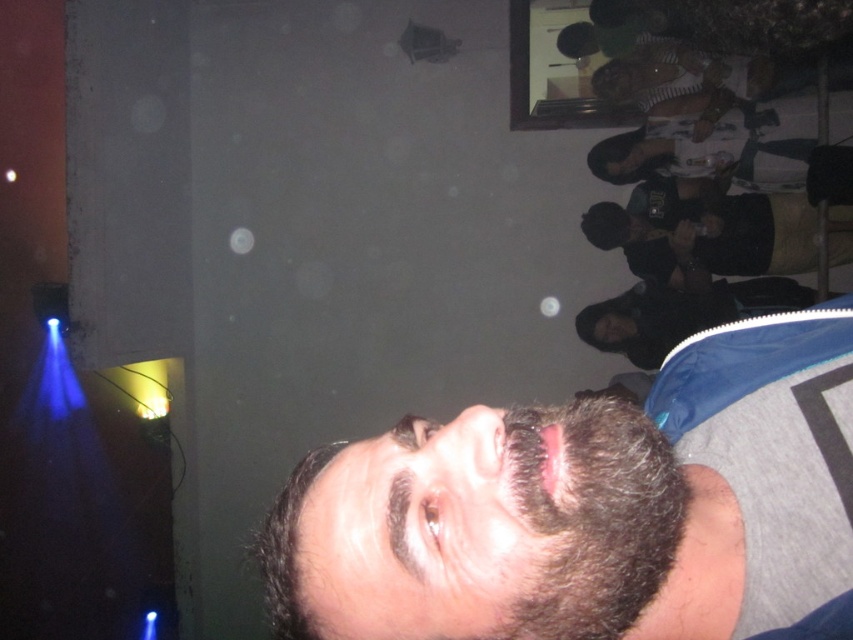
You are a photographer at the event and want to capture a closeup of the dark brown fuzzy beard at lower center and the dark blue shirt at right. Since the beard is smaller, will it be easier to focus on the beard compared to the shirt?

The dark brown fuzzy beard at lower center occupies less space than dark blue shirt at right, so it might be easier to focus on the beard since it is smaller and more defined.